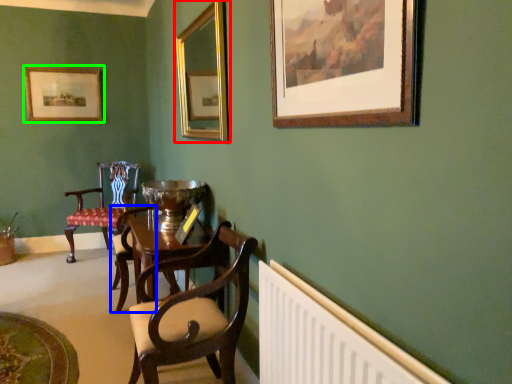
Question: Which object is positioned farthest from picture frame (highlighted by a red box)? Select from armchair (highlighted by a blue box) and picture frame (highlighted by a green box).

Choices:
 (A) armchair
 (B) picture frame

Answer: (A)